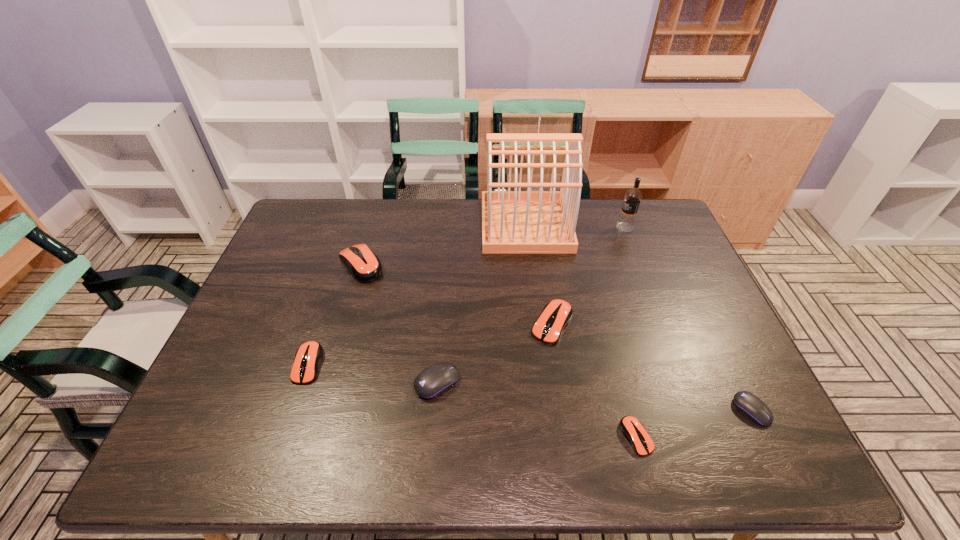
This screenshot has height=540, width=960. I want to click on object that is the fifth nearest to the bigger black computer mouse, so (513, 222).

Locate an element on the screen. The width and height of the screenshot is (960, 540). the seventh closest object relative to the farthest computer mouse is located at coordinates (748, 404).

This screenshot has width=960, height=540. I want to click on computer mouse that stands as the fourth closest to the tallest computer mouse, so click(633, 430).

Identify which computer mouse is the fifth closest to the second biggest orange computer mouse. Please provide its 2D coordinates. Your answer should be formatted as a tuple, i.e. [(x, y)], where the tuple contains the x and y coordinates of a point satisfying the conditions above.

[(307, 359)]

Where is `orange computer mouse that can be found as the closest to the farthest orange computer mouse`? orange computer mouse that can be found as the closest to the farthest orange computer mouse is located at coordinates (307, 359).

In order to click on orange computer mouse that is the closest to the second smallest orange computer mouse in this screenshot , I will do [364, 265].

The height and width of the screenshot is (540, 960). In order to click on vacant region that satisfies the following two spatial constraints: 1. with an open door on the beige birdcage; 2. on the right side of the fourth computer mouse from left to right in this screenshot , I will do pyautogui.click(x=539, y=325).

Find the location of `free spot that satisfies the following two spatial constraints: 1. on the label of the smaller black computer mouse; 2. on the right side of the vodka`. free spot that satisfies the following two spatial constraints: 1. on the label of the smaller black computer mouse; 2. on the right side of the vodka is located at coordinates (695, 410).

Find the location of a particular element. The width and height of the screenshot is (960, 540). vacant space that satisfies the following two spatial constraints: 1. with an open door on the tallest object; 2. on the left side of the third computer mouse from right to left is located at coordinates (539, 325).

Where is `free point that satisfies the following two spatial constraints: 1. on the front side of the nearest orange computer mouse; 2. on the left side of the second biggest orange computer mouse`? The image size is (960, 540). free point that satisfies the following two spatial constraints: 1. on the front side of the nearest orange computer mouse; 2. on the left side of the second biggest orange computer mouse is located at coordinates (569, 437).